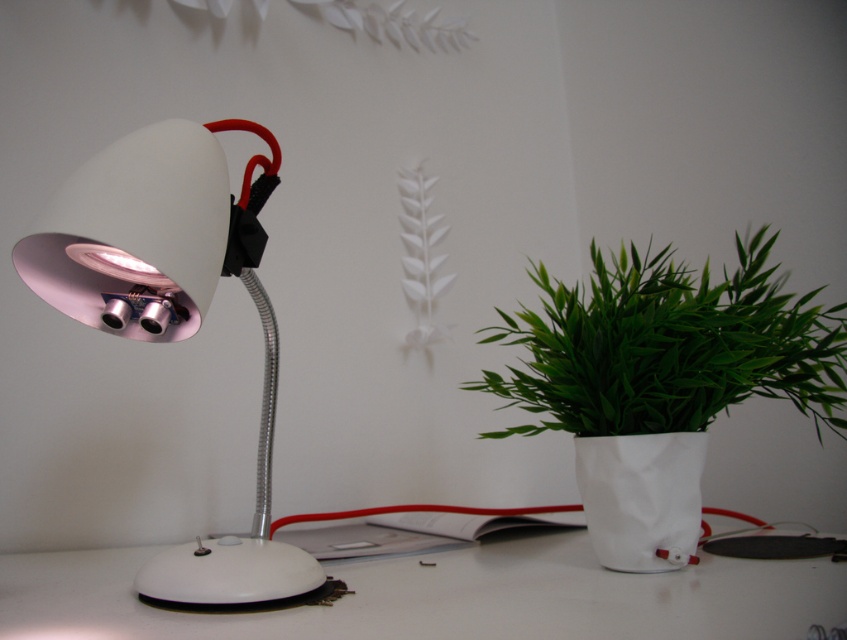
Question: Is white glossy desk lamp at left to the right of green leafy plant at right from the viewer's perspective?

Choices:
 (A) yes
 (B) no

Answer: (B)

Question: Can you confirm if white glossy table at center is thinner than green leafy plant at right?

Choices:
 (A) no
 (B) yes

Answer: (A)

Question: Is white glossy desk lamp at left to the right of green leafy plant at right from the viewer's perspective?

Choices:
 (A) yes
 (B) no

Answer: (B)

Question: Which object is the closest to the green leafy plant at right?

Choices:
 (A) white glossy table at center
 (B) white glossy desk lamp at left

Answer: (A)

Question: Considering the real-world distances, which object is farthest from the white glossy desk lamp at left?

Choices:
 (A) white glossy table at center
 (B) green leafy plant at right

Answer: (B)

Question: Estimate the real-world distances between objects in this image. Which object is farther from the white glossy desk lamp at left?

Choices:
 (A) green leafy plant at right
 (B) white glossy table at center

Answer: (A)